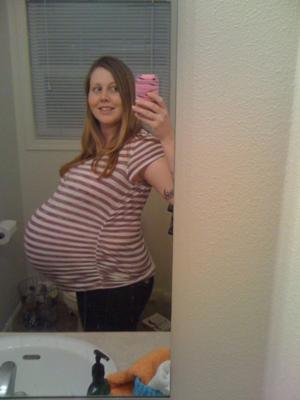
This screenshot has height=400, width=300. Find the location of `counter top`. counter top is located at coordinates (123, 344).